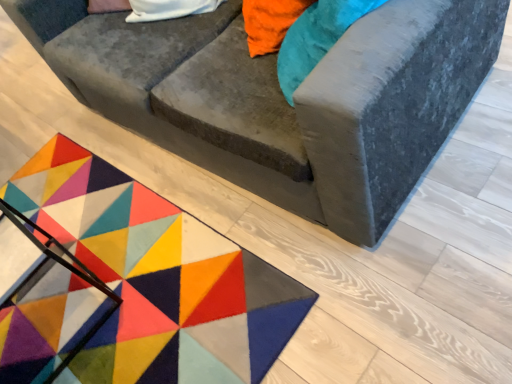
Question: In the image, is multicolored felt mat at lower left on the left side or the right side of velvet gray couch at center?

Choices:
 (A) right
 (B) left

Answer: (B)

Question: Is multicolored felt mat at lower left taller or shorter than velvet gray couch at center?

Choices:
 (A) short
 (B) tall

Answer: (A)

Question: Considering their positions, is multicolored felt mat at lower left located in front of or behind velvet gray couch at center?

Choices:
 (A) front
 (B) behind

Answer: (B)

Question: From a real-world perspective, is velvet gray couch at center positioned above or below multicolored felt mat at lower left?

Choices:
 (A) above
 (B) below

Answer: (A)

Question: Based on their sizes in the image, would you say velvet gray couch at center is bigger or smaller than multicolored felt mat at lower left?

Choices:
 (A) big
 (B) small

Answer: (A)

Question: From the image's perspective, is velvet gray couch at center located above or below multicolored felt mat at lower left?

Choices:
 (A) below
 (B) above

Answer: (B)

Question: Is velvet gray couch at center wider or thinner than multicolored felt mat at lower left?

Choices:
 (A) wide
 (B) thin

Answer: (A)